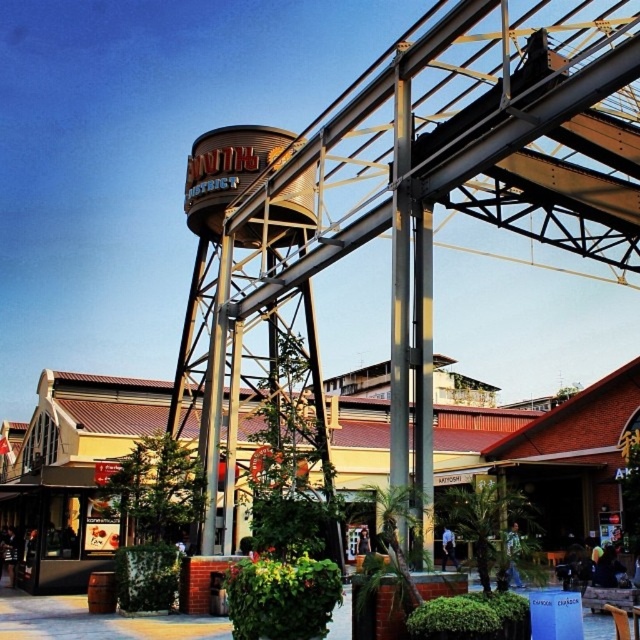
Does brown metallic water tower at center have a greater height compared to brown wooden amusement park at center?

Correct, brown metallic water tower at center is much taller as brown wooden amusement park at center.

Is the position of brown metallic water tower at center less distant than that of brown wooden amusement park at center?

Yes, it is.

The width and height of the screenshot is (640, 640). Identify the location of brown metallic water tower at center. (252, 337).